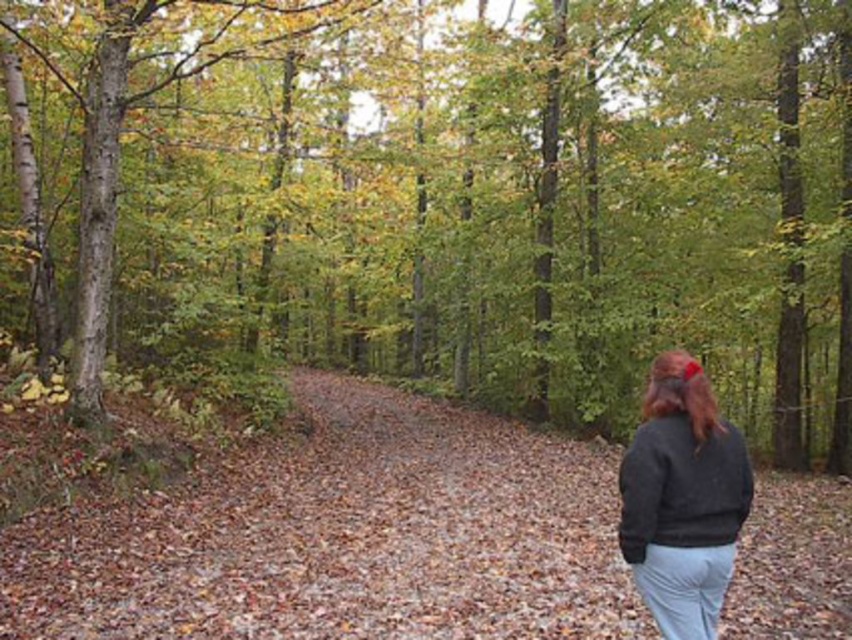
You are standing at the starting point of the forest path. Where exactly is the brown leafy forest path at center located?

The brown leafy forest path at center is located at point (343, 538).

You are standing on the path in the forest and see two points marked in the image. The first point is at coordinates point (586,342) and the second point is at point (663,369). Which point is closer to you?

Point (586,342) is closer to you because it is further to the camera than point (663,369).